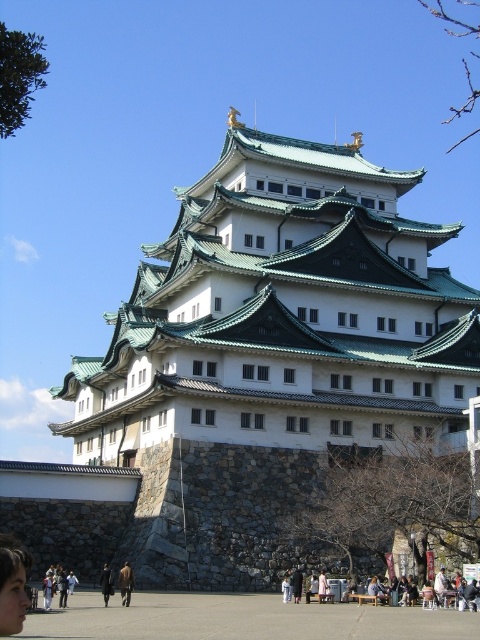
Is smooth skin face at lower left thinner than dark blue jacket at lower center?

Yes.

Between smooth skin face at lower left and dark blue jacket at lower center, which one is positioned higher?

smooth skin face at lower left

Is point (11, 556) positioned behind point (70, 588)?

That is False.

Where is `smooth skin face at lower left`? smooth skin face at lower left is located at coordinates (12, 589).

Who is positioned more to the left, light brown leather jacket at lower left or light pink fabric dress at center?

light brown leather jacket at lower left is more to the left.

Who is more distant from viewer, (x=45, y=577) or (x=320, y=600)?

The point (x=45, y=577) is behind.

Is point (52, 584) behind point (325, 584)?

No, it is in front of (325, 584).

The image size is (480, 640). What are the coordinates of `light brown leather jacket at lower left` in the screenshot? It's located at (48, 589).

Which of these two, brown leather jacket at lower center or dark blue jacket at lower center, stands taller?

With more height is brown leather jacket at lower center.

Between point (129, 579) and point (75, 579), which one is positioned in front?

Point (129, 579)

The height and width of the screenshot is (640, 480). In order to click on brown leather jacket at lower center in this screenshot , I will do `click(126, 582)`.